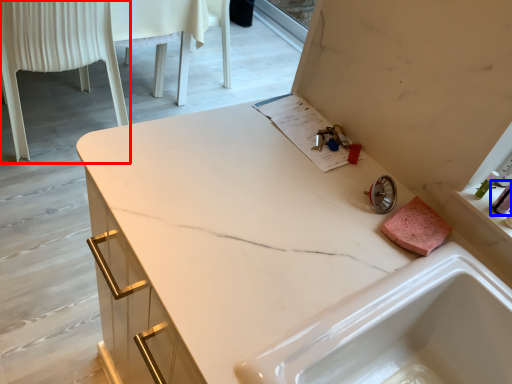
Question: Which object is further to the camera taking this photo, chair (highlighted by a red box) or toiletry (highlighted by a blue box)?

Choices:
 (A) chair
 (B) toiletry

Answer: (A)